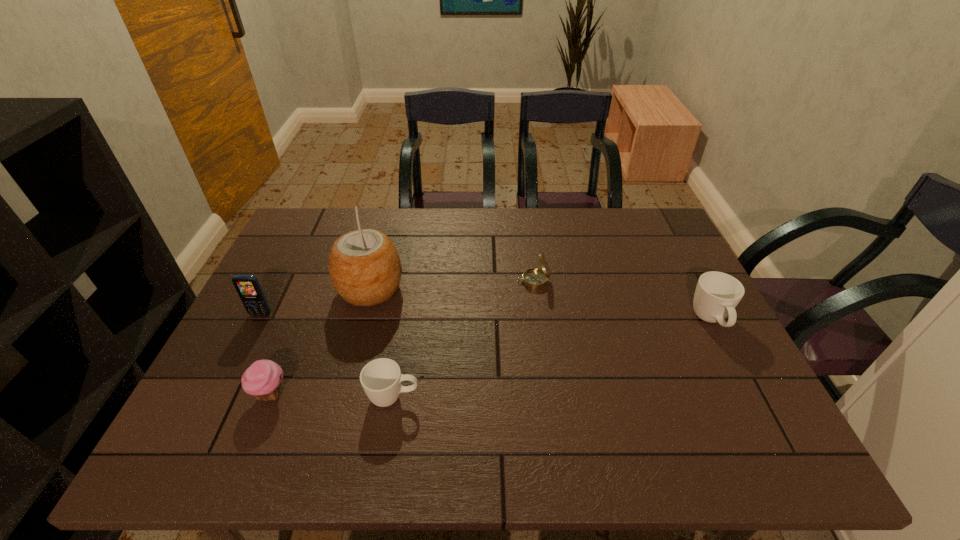
Where is `empty location between the left cup and the leftmost object`? empty location between the left cup and the leftmost object is located at coordinates (327, 356).

The image size is (960, 540). Identify the location of blank region between the left cup and the coconut. (382, 343).

Find the location of a particular element. free space between the fifth object from right to left and the nearer cup is located at coordinates (332, 395).

Find the location of `blank region between the nearer cup and the cupcake`. blank region between the nearer cup and the cupcake is located at coordinates (332, 395).

Image resolution: width=960 pixels, height=540 pixels. Identify the location of free space that is in between the compass and the coconut. (452, 285).

What are the coordinates of `empty location between the second object from right to left and the rightmost object` in the screenshot? It's located at (622, 301).

At what (x,y) coordinates should I click in order to perform the action: click on free spot between the tallest object and the cupcake. Please return your answer as a coordinate pair (x, y). The width and height of the screenshot is (960, 540). Looking at the image, I should click on (321, 341).

Where is `free space between the left cup and the second tallest object`? free space between the left cup and the second tallest object is located at coordinates (327, 356).

Locate which object ranks in proximity to the coconut. Please provide its 2D coordinates. Your answer should be formatted as a tuple, i.e. [(x, y)], where the tuple contains the x and y coordinates of a point satisfying the conditions above.

[(248, 288)]

Locate which object is the third closest to the second object from right to left. Please provide its 2D coordinates. Your answer should be formatted as a tuple, i.e. [(x, y)], where the tuple contains the x and y coordinates of a point satisfying the conditions above.

[(381, 378)]